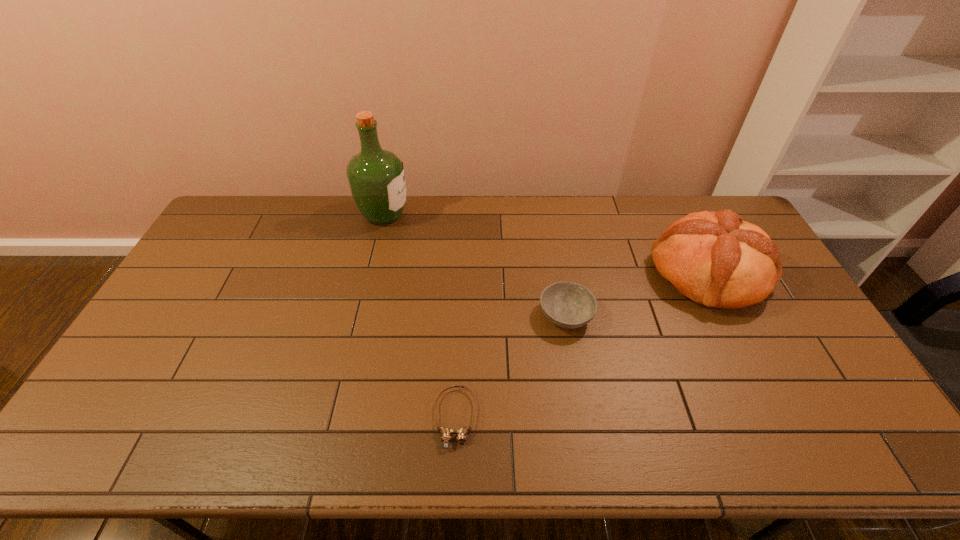
Identify which object is located as the third nearest to the rightmost object. Please provide its 2D coordinates. Your answer should be formatted as a tuple, i.e. [(x, y)], where the tuple contains the x and y coordinates of a point satisfying the conditions above.

[(376, 177)]

Where is `object that is the second closest one to the second shortest object`? The image size is (960, 540). object that is the second closest one to the second shortest object is located at coordinates (446, 433).

You are a GUI agent. You are given a task and a screenshot of the screen. Output one action in this format:
    pyautogui.click(x=<x>, y=<y>)
    Task: Click on the blank area in the image that satisfies the following two spatial constraints: 1. on the front-facing side of the tallest object; 2. on the back side of the second shortest object
    The width and height of the screenshot is (960, 540).
    Given the screenshot: What is the action you would take?
    359,315

Identify the location of vacant space that satisfies the following two spatial constraints: 1. on the front-facing side of the bowl; 2. on the right side of the leftmost object. This screenshot has height=540, width=960. (359, 315).

Locate an element on the screen. This screenshot has width=960, height=540. free region that satisfies the following two spatial constraints: 1. on the front-facing side of the third shortest object; 2. on the right side of the leftmost object is located at coordinates (370, 273).

Locate an element on the screen. vacant space that satisfies the following two spatial constraints: 1. on the back side of the rightmost object; 2. on the right side of the third object from left to right is located at coordinates (559, 273).

You are a GUI agent. You are given a task and a screenshot of the screen. Output one action in this format:
    pyautogui.click(x=<x>, y=<y>)
    Task: Click on the free location that satisfies the following two spatial constraints: 1. on the back side of the second tallest object; 2. on the front-facing side of the farthest object
    This screenshot has height=540, width=960.
    Given the screenshot: What is the action you would take?
    pyautogui.click(x=678, y=214)

Where is `free point that satisfies the following two spatial constraints: 1. on the front-facing side of the liquor; 2. on the left side of the bread`? free point that satisfies the following two spatial constraints: 1. on the front-facing side of the liquor; 2. on the left side of the bread is located at coordinates (370, 273).